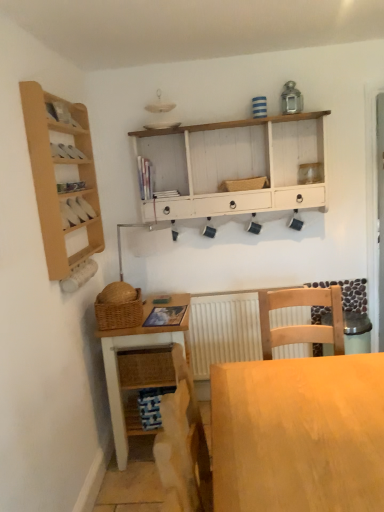
What are the coordinates of `empty space that is ontop of white painted wood cabinet at upper center (from a real-world perspective)` in the screenshot? It's located at (218, 123).